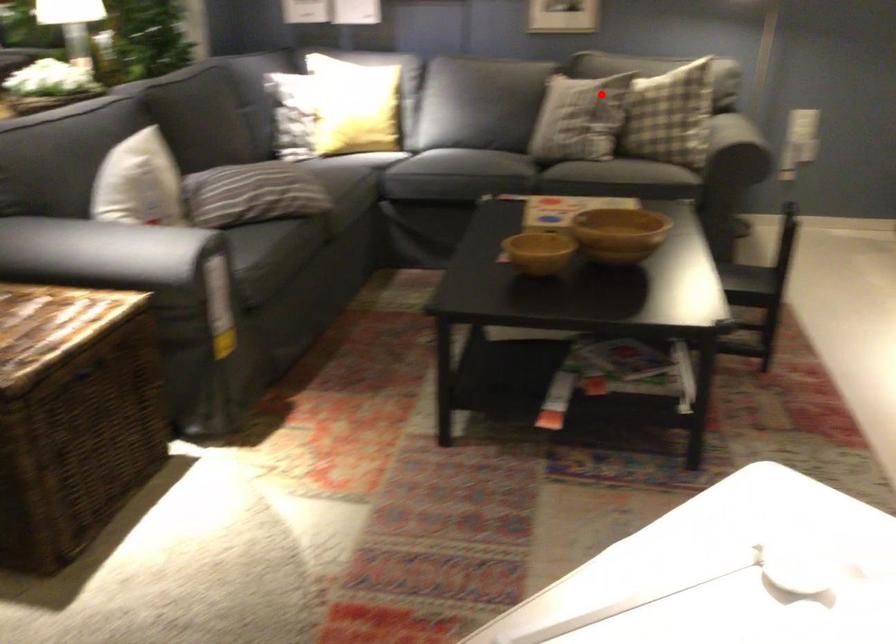
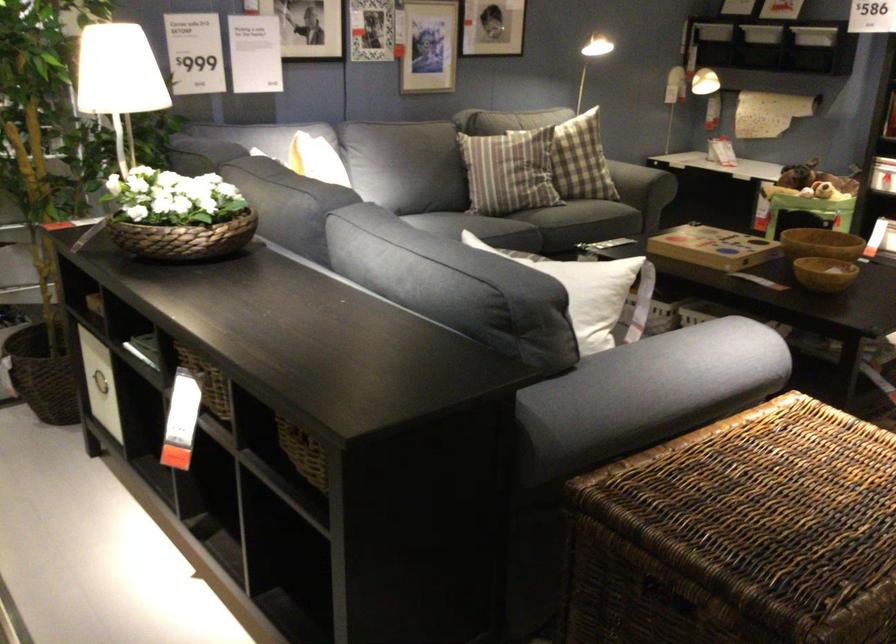
Question: A red point is marked in image1. In image2, is the corresponding 3D point closer to the camera or farther? Reply with the corresponding letter.

Choices:
 (A) The corresponding 3D point is closer.
 (B) The corresponding 3D point is farther.

Answer: (B)